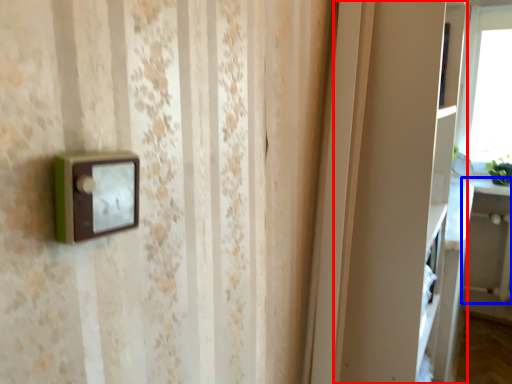
Question: Which point is further to the camera, cabinet (highlighted by a red box) or table (highlighted by a blue box)?

Choices:
 (A) cabinet
 (B) table

Answer: (B)